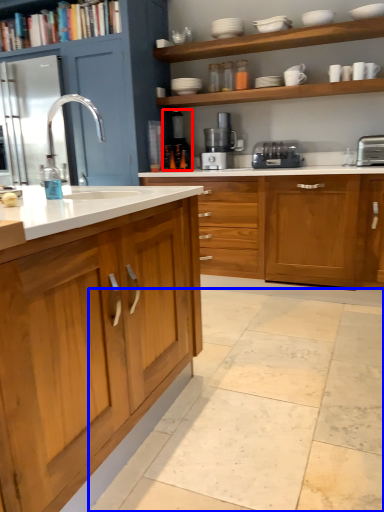
Question: Which of the following is the farthest to the observer, coffee machine (highlighted by a red box) or ceramic tile (highlighted by a blue box)?

Choices:
 (A) coffee machine
 (B) ceramic tile

Answer: (A)